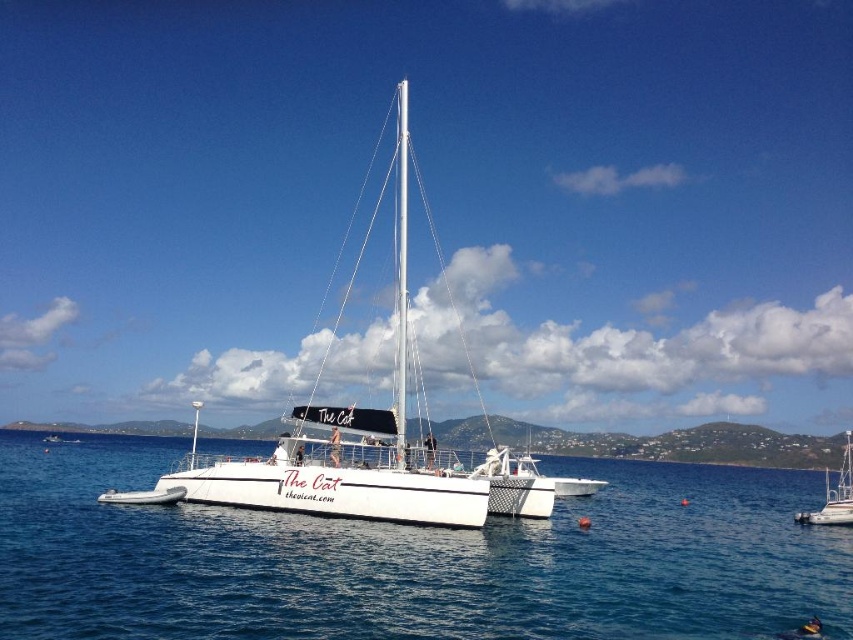
Which of these two, white water at center or white matte sailboat at lower right, stands shorter?

Standing shorter between the two is white water at center.

Between point (741, 492) and point (846, 442), which one is positioned behind?

Positioned behind is point (846, 442).

Where is `white water at center`? The height and width of the screenshot is (640, 853). white water at center is located at coordinates (412, 560).

This screenshot has width=853, height=640. I want to click on white water at center, so click(x=412, y=560).